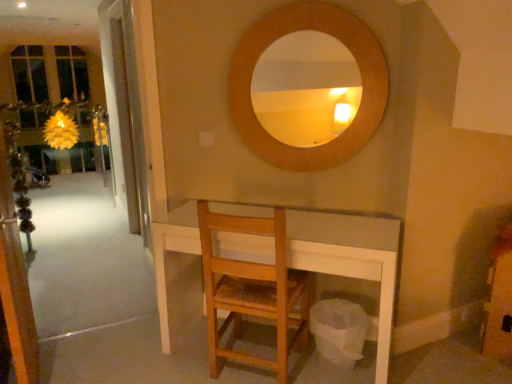
Question: In terms of size, does clear glass door at left, which is counted as the 2th screen door, starting from the front, appear bigger or smaller than wooden chair at center?

Choices:
 (A) small
 (B) big

Answer: (A)

Question: From the image's perspective, is clear glass door at left, the first screen door in the back-to-front sequence, above or below wooden chair at center?

Choices:
 (A) above
 (B) below

Answer: (A)

Question: Considering the real-world distances, which object is farthest from the clear glass door at left, which is counted as the 2th screen door, starting from the front?

Choices:
 (A) transparent glass screen door at left, the second screen door from the back
 (B) wooden chair at center
 (C) wooden circle at upper center

Answer: (B)

Question: Which object is positioned farthest from the clear glass door at left, the first screen door in the back-to-front sequence?

Choices:
 (A) wooden chair at center
 (B) transparent glass screen door at left, the second screen door from the back
 (C) wooden circle at upper center

Answer: (A)